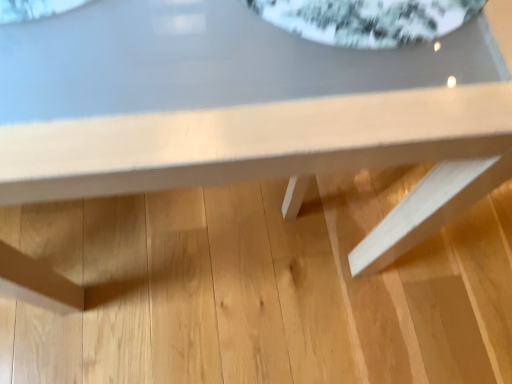
The width and height of the screenshot is (512, 384). I want to click on translucent glass bowl at upper center, so click(x=367, y=20).

The width and height of the screenshot is (512, 384). What do you see at coordinates (367, 20) in the screenshot? I see `translucent glass bowl at upper center` at bounding box center [367, 20].

The image size is (512, 384). Identify the location of translucent glass bowl at upper center. (367, 20).